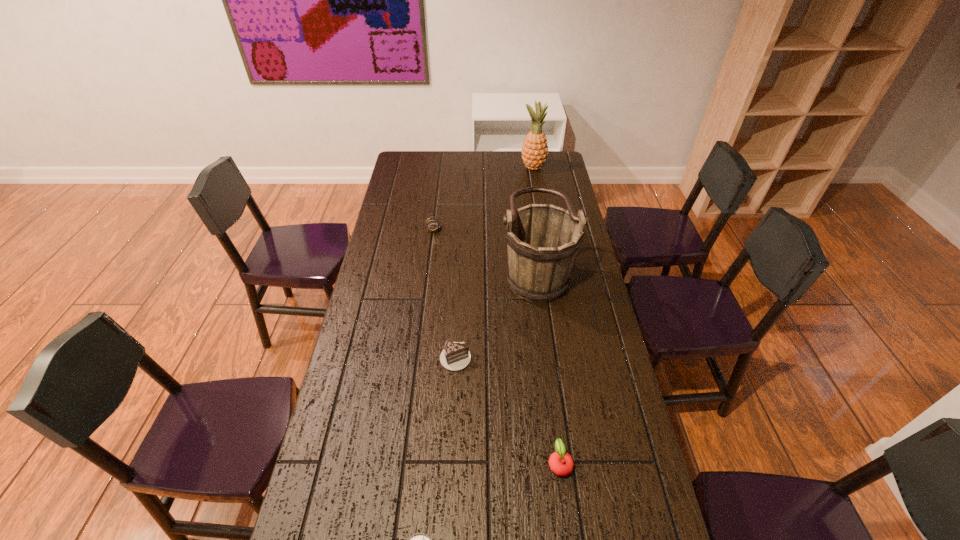
Image resolution: width=960 pixels, height=540 pixels. I want to click on the tallest object, so click(x=534, y=152).

Where is `pineapple`? This screenshot has height=540, width=960. pineapple is located at coordinates (534, 152).

Where is `the second tallest object`? the second tallest object is located at coordinates (542, 240).

Where is `bucket`? The width and height of the screenshot is (960, 540). bucket is located at coordinates (542, 240).

Where is `the taller compass`? the taller compass is located at coordinates (432, 224).

Find the location of a particular element. the third tallest object is located at coordinates (432, 224).

Locate an element on the screen. This screenshot has height=540, width=960. the fourth farthest object is located at coordinates (454, 357).

Where is `the fifth farthest object`? the fifth farthest object is located at coordinates (560, 462).

Where is `vacant space located 0.090m on the left of the farthest object`? vacant space located 0.090m on the left of the farthest object is located at coordinates (502, 167).

Where is `free region located on the handle side of the third farthest object`? free region located on the handle side of the third farthest object is located at coordinates (409, 269).